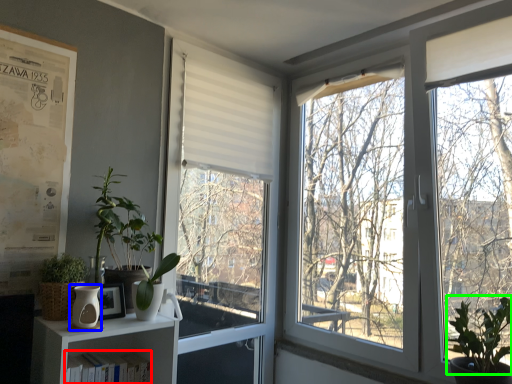
Question: Estimate the real-world distances between objects in this image. Which object is closer to book (highlighted by a red box), vase (highlighted by a blue box) or vegetation (highlighted by a green box)?

Choices:
 (A) vase
 (B) vegetation

Answer: (A)